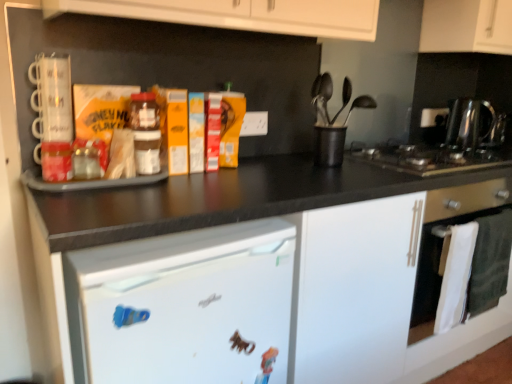
Question: Considering the relative sizes of white matte refrigerator at lower left and white glossy oven at lower right in the image provided, is white matte refrigerator at lower left bigger than white glossy oven at lower right?

Choices:
 (A) yes
 (B) no

Answer: (A)

Question: Is white matte refrigerator at lower left outside of white glossy oven at lower right?

Choices:
 (A) yes
 (B) no

Answer: (A)

Question: Does white matte refrigerator at lower left come behind white glossy oven at lower right?

Choices:
 (A) no
 (B) yes

Answer: (A)

Question: Is the depth of white matte refrigerator at lower left less than that of white glossy oven at lower right?

Choices:
 (A) yes
 (B) no

Answer: (A)

Question: Can you confirm if white matte refrigerator at lower left is wider than white glossy oven at lower right?

Choices:
 (A) yes
 (B) no

Answer: (A)

Question: From their relative heights in the image, would you say white matte cabinet at upper right is taller or shorter than black stainless steel gas stove at right?

Choices:
 (A) tall
 (B) short

Answer: (A)

Question: Considering the positions of point (422, 16) and point (455, 167), is point (422, 16) closer or farther from the camera than point (455, 167)?

Choices:
 (A) farther
 (B) closer

Answer: (A)

Question: From the image's perspective, is white matte cabinet at upper right above or below black stainless steel gas stove at right?

Choices:
 (A) below
 (B) above

Answer: (B)

Question: Considering their positions, is white matte cabinet at upper right located in front of or behind black stainless steel gas stove at right?

Choices:
 (A) front
 (B) behind

Answer: (B)

Question: Is white matte cabinet at upper right bigger or smaller than polished stainless steel kettle at right?

Choices:
 (A) big
 (B) small

Answer: (A)

Question: Considering the positions of point (429, 49) and point (455, 104), is point (429, 49) closer or farther from the camera than point (455, 104)?

Choices:
 (A) closer
 (B) farther

Answer: (A)

Question: From the image's perspective, is white matte cabinet at upper right above or below polished stainless steel kettle at right?

Choices:
 (A) below
 (B) above

Answer: (B)

Question: Relative to polished stainless steel kettle at right, is white matte cabinet at upper right in front or behind?

Choices:
 (A) behind
 (B) front

Answer: (B)

Question: Is white glossy oven at lower right situated inside black plastic utensil holder at center or outside?

Choices:
 (A) outside
 (B) inside

Answer: (A)

Question: Considering the positions of white glossy oven at lower right and black plastic utensil holder at center in the image, is white glossy oven at lower right bigger or smaller than black plastic utensil holder at center?

Choices:
 (A) big
 (B) small

Answer: (A)